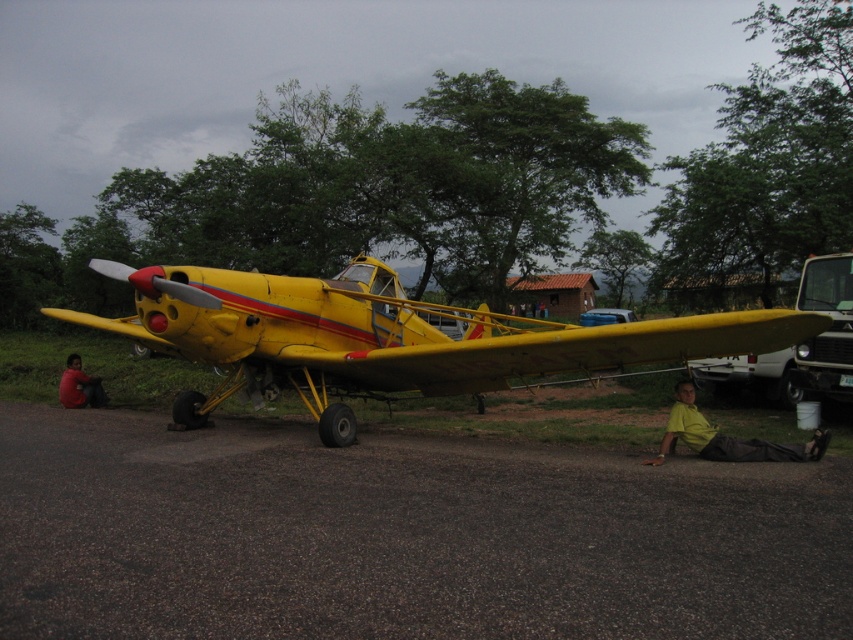
Question: Is yellow matte airplane at center bigger than yellow cotton shirt at lower right?

Choices:
 (A) yes
 (B) no

Answer: (A)

Question: Which object is closer to the camera taking this photo?

Choices:
 (A) yellow matte airplane at center
 (B) yellow cotton shirt at lower right
 (C) dark red shirt at lower left

Answer: (A)

Question: Is yellow matte airplane at center thinner than yellow cotton shirt at lower right?

Choices:
 (A) no
 (B) yes

Answer: (A)

Question: Which of the following is the closest to the observer?

Choices:
 (A) (683, 404)
 (B) (67, 385)
 (C) (395, 328)

Answer: (A)

Question: Observing the image, what is the correct spatial positioning of yellow matte airplane at center in reference to yellow cotton shirt at lower right?

Choices:
 (A) right
 (B) left

Answer: (B)

Question: Which object is the closest to the yellow matte airplane at center?

Choices:
 (A) dark red shirt at lower left
 (B) yellow cotton shirt at lower right

Answer: (B)